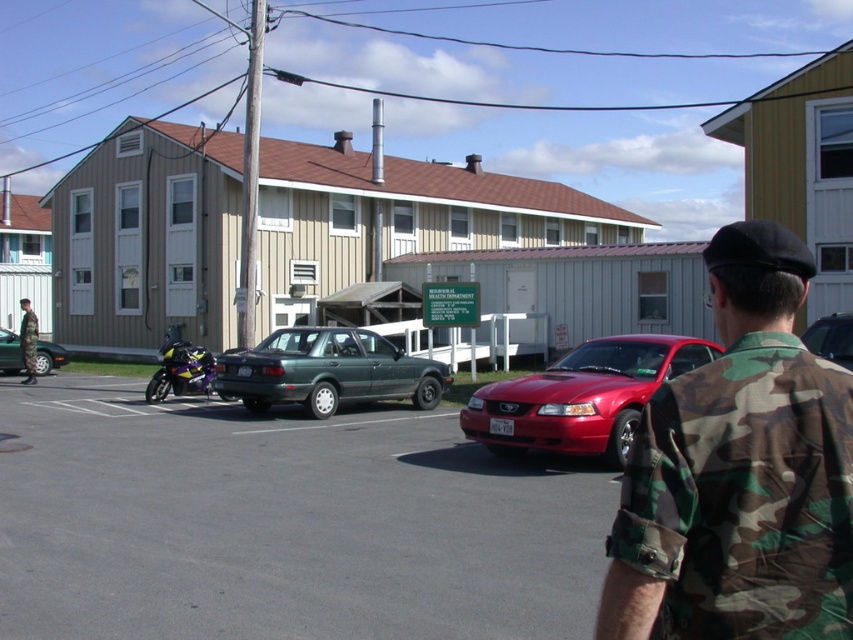
Question: Is glossy red car at center thinner than shiny purple motorcycle at left?

Choices:
 (A) yes
 (B) no

Answer: (A)

Question: Estimate the real-world distances between objects in this image. Which object is closer to the shiny purple motorcycle at left?

Choices:
 (A) camouflage uniform at lower left
 (B) green matte sedan at center
 (C) glossy red car at center

Answer: (B)

Question: Does green matte sedan at center have a larger size compared to green matte sedan at left?

Choices:
 (A) no
 (B) yes

Answer: (B)

Question: Does shiny purple motorcycle at left have a larger size compared to metallic silver sedan at center?

Choices:
 (A) no
 (B) yes

Answer: (B)

Question: Estimate the real-world distances between objects in this image. Which object is farther from the camo uniform at right?

Choices:
 (A) green matte sedan at center
 (B) camouflage uniform at lower left

Answer: (B)

Question: Estimate the real-world distances between objects in this image. Which object is closer to the green matte sedan at left?

Choices:
 (A) green matte sedan at center
 (B) metallic silver sedan at center
 (C) shiny purple motorcycle at left
 (D) glossy red car at center

Answer: (C)